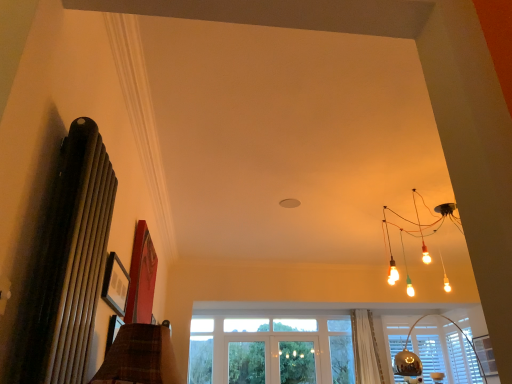
Question: Are metallic silver lampshade at lower right and matte black picture frame at upper left beside each other?

Choices:
 (A) yes
 (B) no

Answer: (B)

Question: Is matte black picture frame at upper left located within metallic silver lampshade at lower right?

Choices:
 (A) no
 (B) yes

Answer: (A)

Question: Is metallic silver lampshade at lower right thinner than matte black picture frame at upper left?

Choices:
 (A) no
 (B) yes

Answer: (A)

Question: Considering the relative sizes of metallic silver lampshade at lower right and matte black picture frame at upper left in the image provided, is metallic silver lampshade at lower right shorter than matte black picture frame at upper left?

Choices:
 (A) no
 (B) yes

Answer: (A)

Question: From a real-world perspective, is metallic silver lampshade at lower right located higher than matte black picture frame at upper left?

Choices:
 (A) no
 (B) yes

Answer: (A)

Question: Can you confirm if metallic silver lampshade at lower right is bigger than matte black picture frame at upper left?

Choices:
 (A) yes
 (B) no

Answer: (A)

Question: Does white sheer curtain at lower center turn towards translucent glass screen door at center?

Choices:
 (A) no
 (B) yes

Answer: (A)

Question: Can you confirm if white sheer curtain at lower center is taller than translucent glass screen door at center?

Choices:
 (A) no
 (B) yes

Answer: (B)

Question: Is white sheer curtain at lower center in contact with translucent glass screen door at center?

Choices:
 (A) no
 (B) yes

Answer: (A)

Question: Would you consider white sheer curtain at lower center to be distant from translucent glass screen door at center?

Choices:
 (A) yes
 (B) no

Answer: (B)

Question: Is white sheer curtain at lower center looking in the opposite direction of translucent glass screen door at center?

Choices:
 (A) no
 (B) yes

Answer: (A)

Question: Is white sheer curtain at lower center located outside translucent glass screen door at center?

Choices:
 (A) no
 (B) yes

Answer: (B)

Question: Are matte black picture frame at upper left and translucent glass screen door at center located far from each other?

Choices:
 (A) no
 (B) yes

Answer: (B)